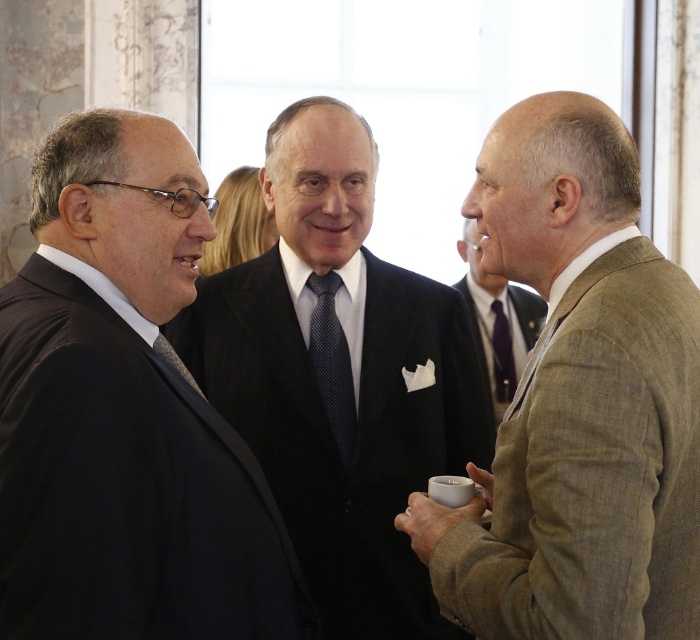
Can you confirm if dark blue dotted tie at center is bigger than matte black tie at center?

Indeed, dark blue dotted tie at center has a larger size compared to matte black tie at center.

At what (x,y) coordinates should I click in order to perform the action: click on dark blue dotted tie at center. Please return your answer as a coordinate pair (x, y). The height and width of the screenshot is (640, 700). Looking at the image, I should click on (332, 364).

Does matte black suit at left have a larger size compared to dark blue dotted tie at center?

Yes.

Which of these two, matte black suit at left or dark blue dotted tie at center, stands taller?

Answer: matte black suit at left

Where is `matte black suit at left`? matte black suit at left is located at coordinates (125, 416).

Is matte black suit at left to the right of tan textured suit at right from the viewer's perspective?

Incorrect, matte black suit at left is not on the right side of tan textured suit at right.

Does point (153, 196) come farther from viewer compared to point (575, 545)?

Yes, it is behind point (575, 545).

Image resolution: width=700 pixels, height=640 pixels. I want to click on matte black suit at left, so click(x=125, y=416).